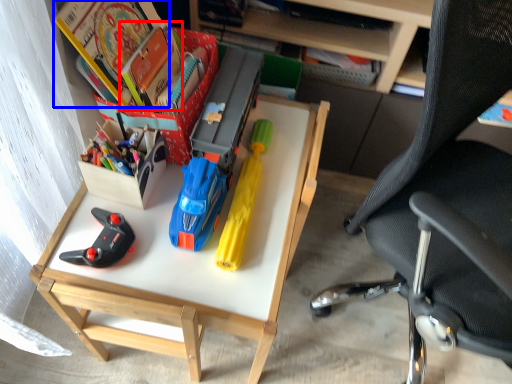
Question: Which point is closer to the camera, book (highlighted by a red box) or book (highlighted by a blue box)?

Choices:
 (A) book
 (B) book

Answer: (B)